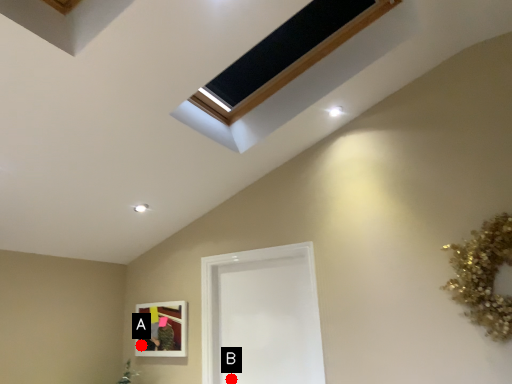
Question: Two points are circled on the image, labeled by A and B beside each circle. Which point is closer to the camera?

Choices:
 (A) A is closer
 (B) B is closer

Answer: (B)